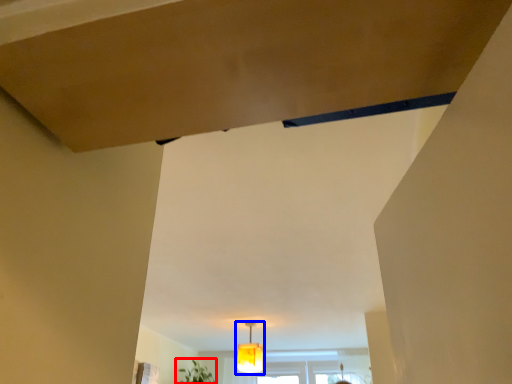
Question: Which object is further to the camera taking this photo, plant (highlighted by a red box) or lamp (highlighted by a blue box)?

Choices:
 (A) plant
 (B) lamp

Answer: (A)